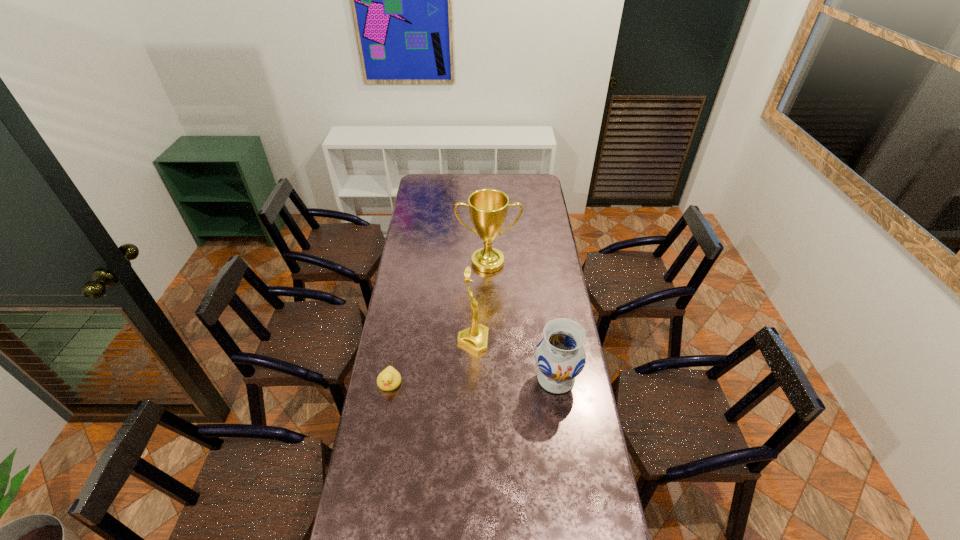
Where is `object at the left edge`? The height and width of the screenshot is (540, 960). object at the left edge is located at coordinates (389, 379).

Image resolution: width=960 pixels, height=540 pixels. Find the location of `object that is at the right edge`. object that is at the right edge is located at coordinates (560, 356).

In the image, there is a desktop. Identify the location of vacant space at the far edge. (478, 177).

Find the location of a particular element. The width and height of the screenshot is (960, 540). free space at the left edge is located at coordinates (380, 505).

Locate an element on the screen. free space at the right edge of the desktop is located at coordinates (601, 516).

Identify the location of free space at the far left corner of the desktop. (440, 181).

I want to click on empty location between the farther award and the vase, so click(x=521, y=320).

This screenshot has width=960, height=540. I want to click on vacant area that lies between the duckling and the third tallest object, so click(x=472, y=380).

Locate an element on the screen. The image size is (960, 540). vacant area that lies between the shortest object and the third nearest object is located at coordinates (431, 362).

I want to click on free space between the shortest object and the rightmost object, so click(472, 380).